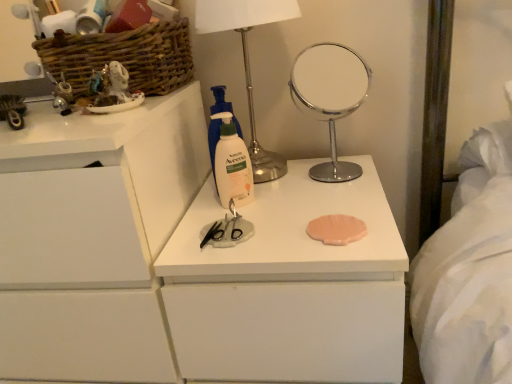
This screenshot has height=384, width=512. I want to click on free space above white matte chest of drawers at center, positioned as the 2th chest of drawers in left-to-right order (from a real-world perspective), so click(281, 204).